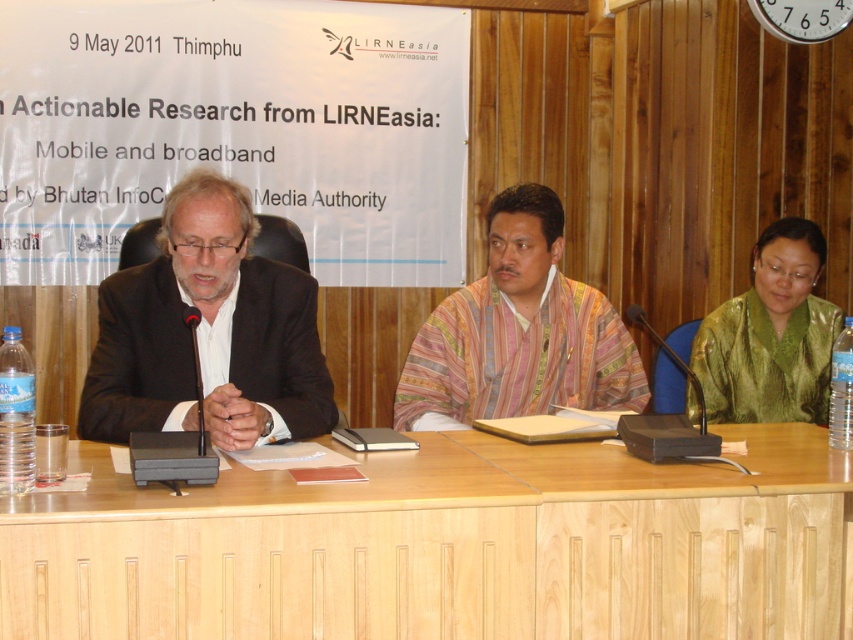
Question: Is light brown wood table at center behind black matte suit at left?

Choices:
 (A) no
 (B) yes

Answer: (A)

Question: Which object is farther from the camera taking this photo?

Choices:
 (A) multicolored woven fabric at center
 (B) black matte suit at left
 (C) light brown wood table at center
 (D) green silk jacket at right

Answer: (D)

Question: Which point is farther to the camera?

Choices:
 (A) light brown wood table at center
 (B) green silk jacket at right
 (C) multicolored woven fabric at center

Answer: (B)

Question: Is multicolored woven fabric at center further to camera compared to green silk jacket at right?

Choices:
 (A) no
 (B) yes

Answer: (A)

Question: Does light brown wood table at center have a greater width compared to multicolored woven fabric at center?

Choices:
 (A) yes
 (B) no

Answer: (A)

Question: Considering the real-world distances, which object is farthest from the black matte suit at left?

Choices:
 (A) green silk jacket at right
 (B) multicolored woven fabric at center

Answer: (A)